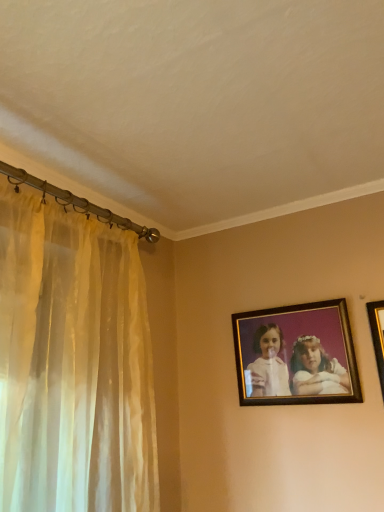
Question: From the image's perspective, is wooden frame at upper right, which is counted as the second picture frame, starting from the front, located above or below gold-framed picture at upper right, the 2th picture frame from the left?

Choices:
 (A) above
 (B) below

Answer: (B)

Question: Considering the positions of wooden frame at upper right, which is counted as the second picture frame, starting from the front, and gold-framed picture at upper right, which is counted as the first picture frame, starting from the right, in the image, is wooden frame at upper right, which is counted as the second picture frame, starting from the front, taller or shorter than gold-framed picture at upper right, which is counted as the first picture frame, starting from the right,?

Choices:
 (A) short
 (B) tall

Answer: (A)

Question: Is wooden frame at upper right, which is counted as the second picture frame, starting from the front, in front of or behind gold-framed picture at upper right, the 1th picture frame when ordered from front to back, in the image?

Choices:
 (A) behind
 (B) front

Answer: (A)

Question: Is gold-framed picture at upper right, which is counted as the first picture frame, starting from the right, in front of or behind wooden frame at upper right, the 1th picture frame positioned from the back, in the image?

Choices:
 (A) behind
 (B) front

Answer: (B)

Question: In the image, is gold-framed picture at upper right, the 1th picture frame when ordered from front to back, on the left side or the right side of wooden frame at upper right, the 1th picture frame viewed from the left?

Choices:
 (A) left
 (B) right

Answer: (B)

Question: Considering the positions of point (380, 369) and point (334, 302), is point (380, 369) closer or farther from the camera than point (334, 302)?

Choices:
 (A) farther
 (B) closer

Answer: (B)

Question: Considering the positions of gold-framed picture at upper right, which is counted as the first picture frame, starting from the right, and wooden frame at upper right, which is counted as the second picture frame, starting from the front, in the image, is gold-framed picture at upper right, which is counted as the first picture frame, starting from the right, bigger or smaller than wooden frame at upper right, which is counted as the second picture frame, starting from the front,?

Choices:
 (A) small
 (B) big

Answer: (A)